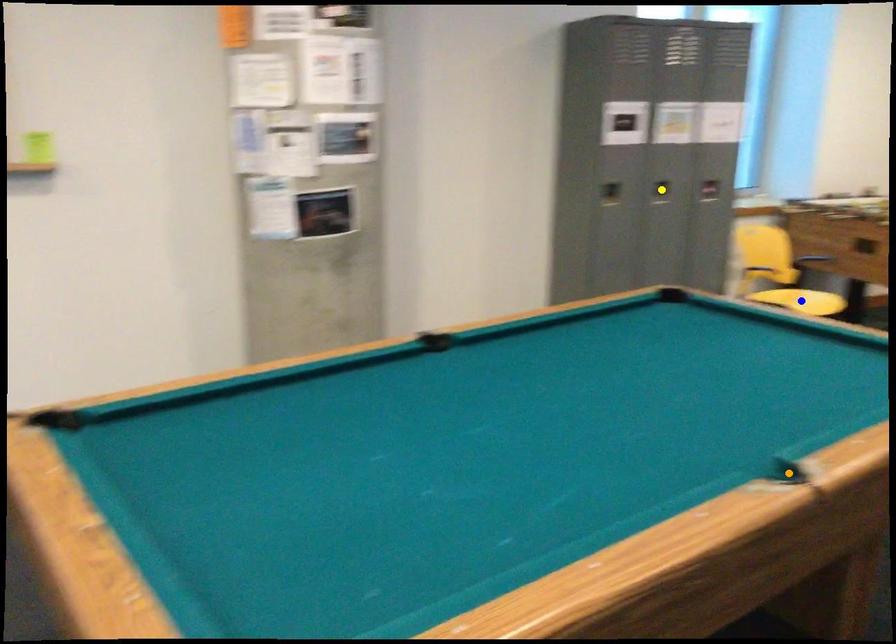
Order these from nearest to farthest:
1. orange point
2. yellow point
3. blue point

orange point < yellow point < blue point